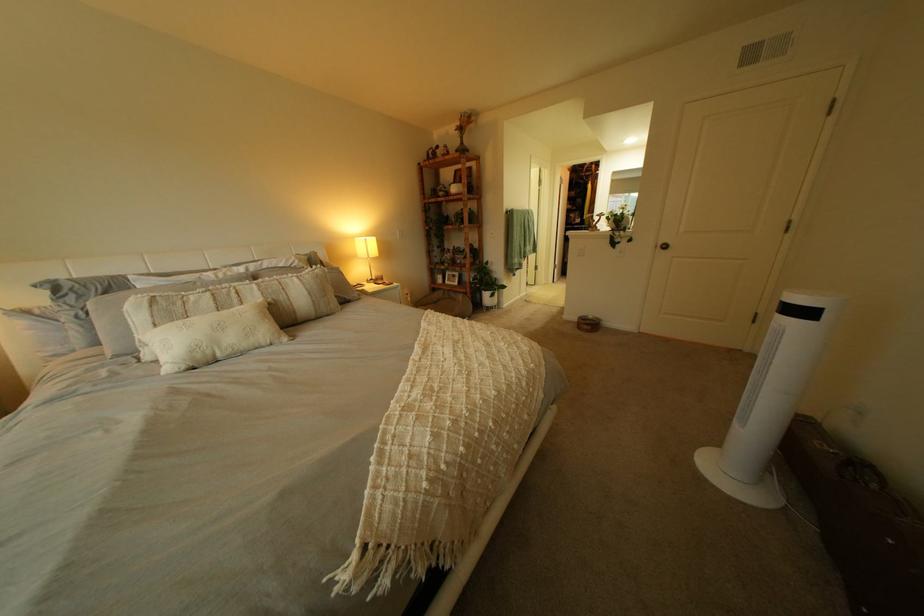
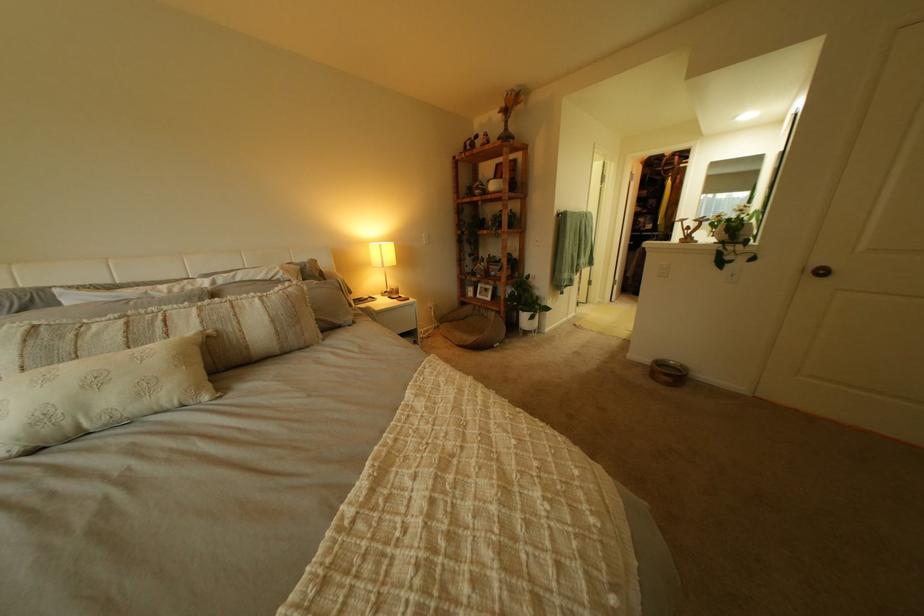
Locate, in the second image, the point that corresponds to the point at 676,251 in the first image.

(825, 276)